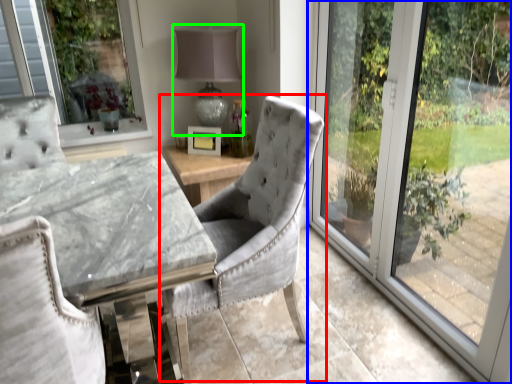
Question: Which object is the closest to the chair (highlighted by a red box)? Choose among these: window (highlighted by a blue box) or table lamp (highlighted by a green box).

Choices:
 (A) window
 (B) table lamp

Answer: (A)